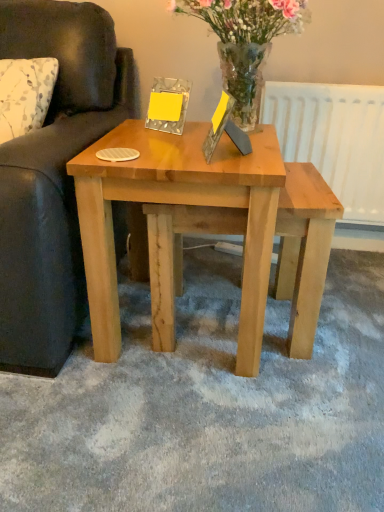
Image resolution: width=384 pixels, height=512 pixels. In order to click on vacant space to the left of wooden picture frame at center in this screenshot , I will do `click(171, 157)`.